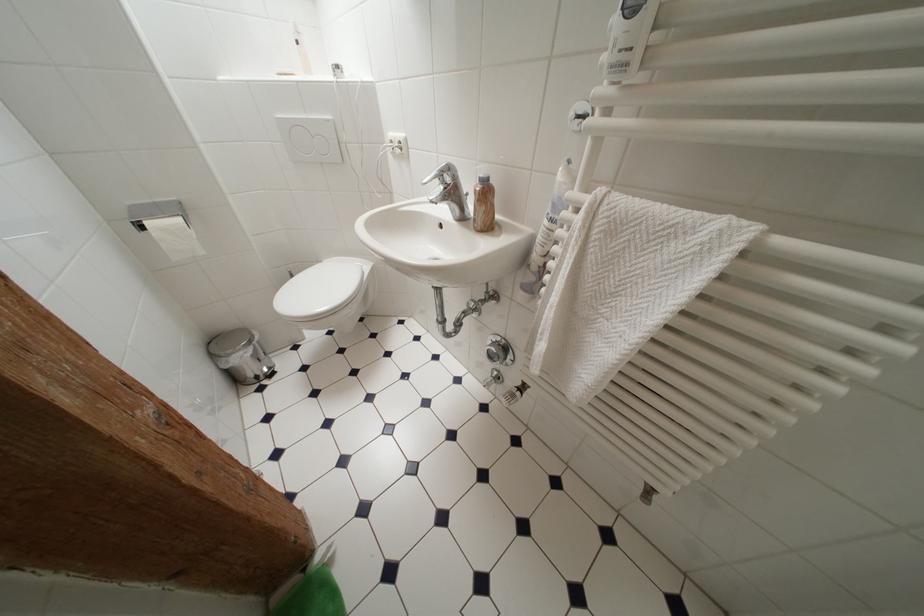
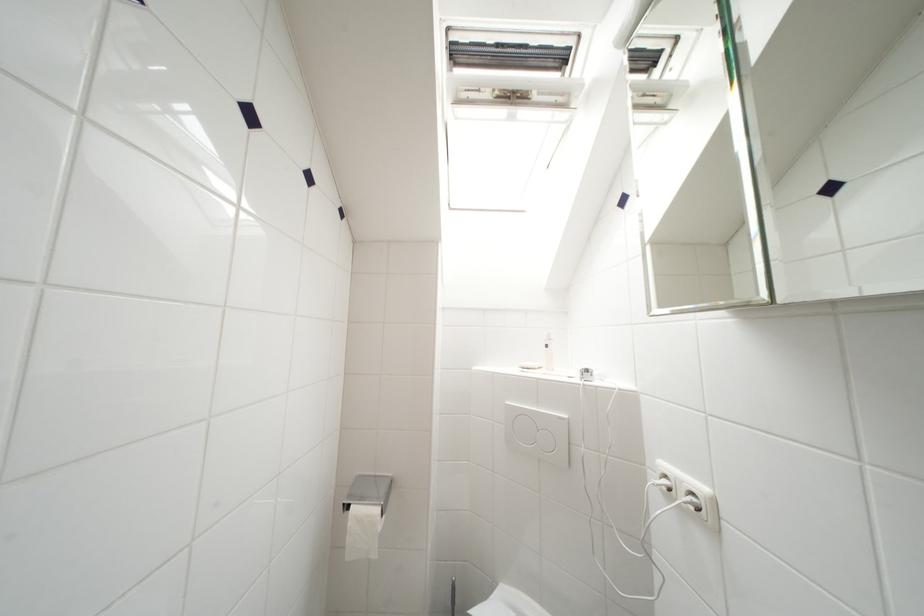
First-person continuous shooting, in which direction is the camera rotating?

The rotation direction of the camera is left-up.